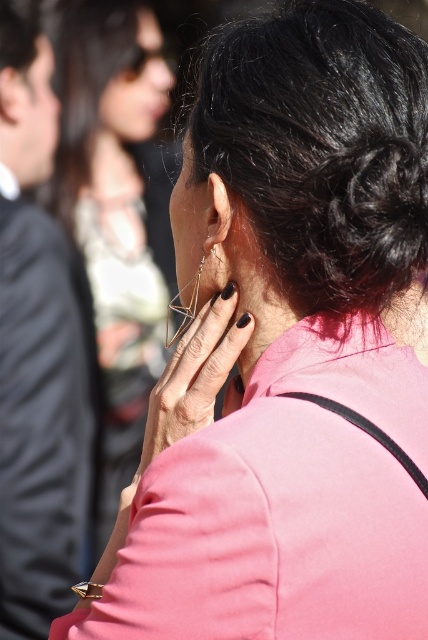
Question: Does dark brown hair at upper left appear on the right side of matte silver earring at center?

Choices:
 (A) yes
 (B) no

Answer: (B)

Question: Which point is closer to the camera taking this photo?

Choices:
 (A) (259, 93)
 (B) (23, 65)
 (C) (65, 218)
 (D) (208, 392)

Answer: (A)

Question: Does black shiny hair at upper left appear on the left side of dark brown hair at upper left?

Choices:
 (A) yes
 (B) no

Answer: (B)

Question: Is dark brown hair at upper left positioned at the back of matte silver earring at center?

Choices:
 (A) no
 (B) yes

Answer: (B)

Question: Which object appears farthest from the camera in this image?

Choices:
 (A) dark brown hair at upper left
 (B) matte silver earring at center
 (C) black shiny hair at upper center

Answer: (A)

Question: Which point is farther to the camera?

Choices:
 (A) (74, 22)
 (B) (35, 10)

Answer: (A)